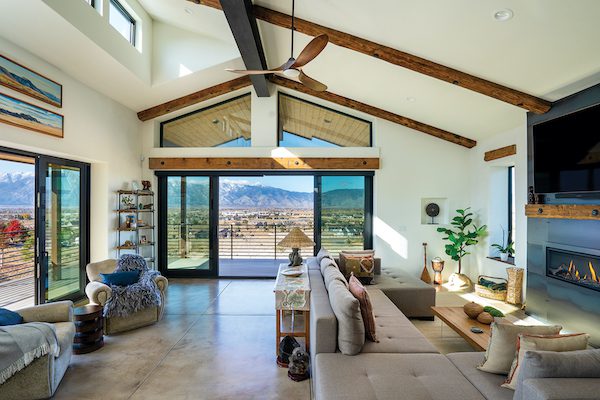
The image size is (600, 400). Find the location of `three pillows on the lower right hand side`. three pillows on the lower right hand side is located at coordinates [566, 367], [568, 347], [501, 346].